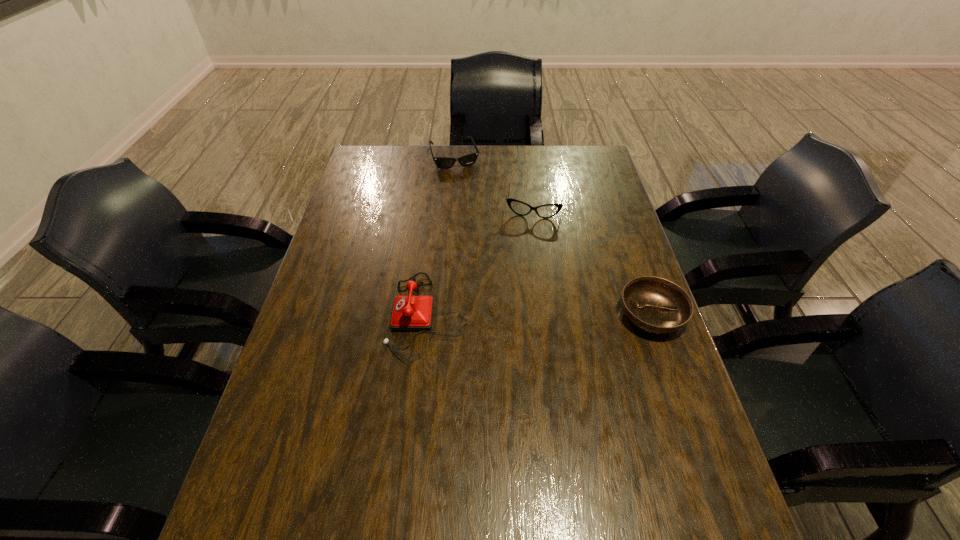
Find the location of a particular element. free space between the tallest object and the sunglasses is located at coordinates (442, 237).

You are a GUI agent. You are given a task and a screenshot of the screen. Output one action in this format:
    pyautogui.click(x=<x>, y=<y>)
    Task: Click on the free space between the telephone and the sunglasses
    
    Given the screenshot: What is the action you would take?
    pyautogui.click(x=442, y=237)

Where is `vacant point located between the telephone and the rightmost object`? vacant point located between the telephone and the rightmost object is located at coordinates (540, 315).

You are a GUI agent. You are given a task and a screenshot of the screen. Output one action in this format:
    pyautogui.click(x=<x>, y=<y>)
    Task: Click on the object that is the third closest to the farthest object
    
    Given the screenshot: What is the action you would take?
    pyautogui.click(x=653, y=304)

Choose which object is the third nearest neighbor to the second farthest object. Please provide its 2D coordinates. Your answer should be formatted as a tuple, i.e. [(x, y)], where the tuple contains the x and y coordinates of a point satisfying the conditions above.

[(653, 304)]

What are the coordinates of `free spot that satisfies the following two spatial constraints: 1. on the front side of the rightmost object; 2. on the left side of the third nearest object` in the screenshot? It's located at (550, 315).

Where is `vacant space that satisfies the following two spatial constraints: 1. on the front side of the rightmost object; 2. on the right side of the farthest object`? Image resolution: width=960 pixels, height=540 pixels. vacant space that satisfies the following two spatial constraints: 1. on the front side of the rightmost object; 2. on the right side of the farthest object is located at coordinates (443, 315).

Locate an element on the screen. The height and width of the screenshot is (540, 960). vacant space that satisfies the following two spatial constraints: 1. on the front side of the farthest object; 2. on the right side of the rightmost object is located at coordinates (443, 315).